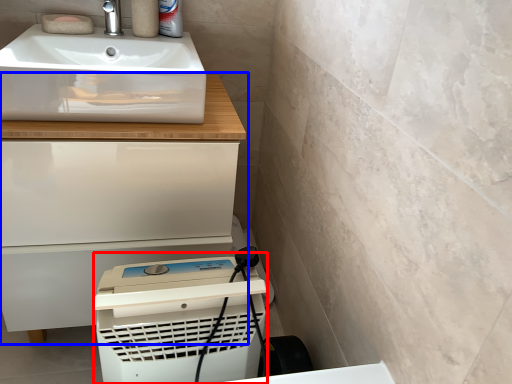
Question: Among these objects, which one is farthest to the camera, appliance (highlighted by a red box) or bathroom cabinet (highlighted by a blue box)?

Choices:
 (A) appliance
 (B) bathroom cabinet

Answer: (B)